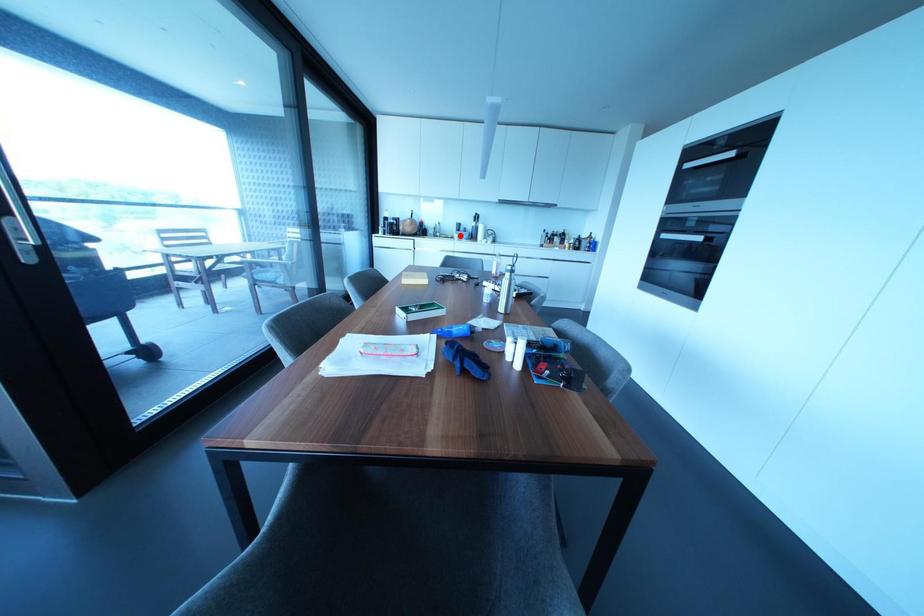
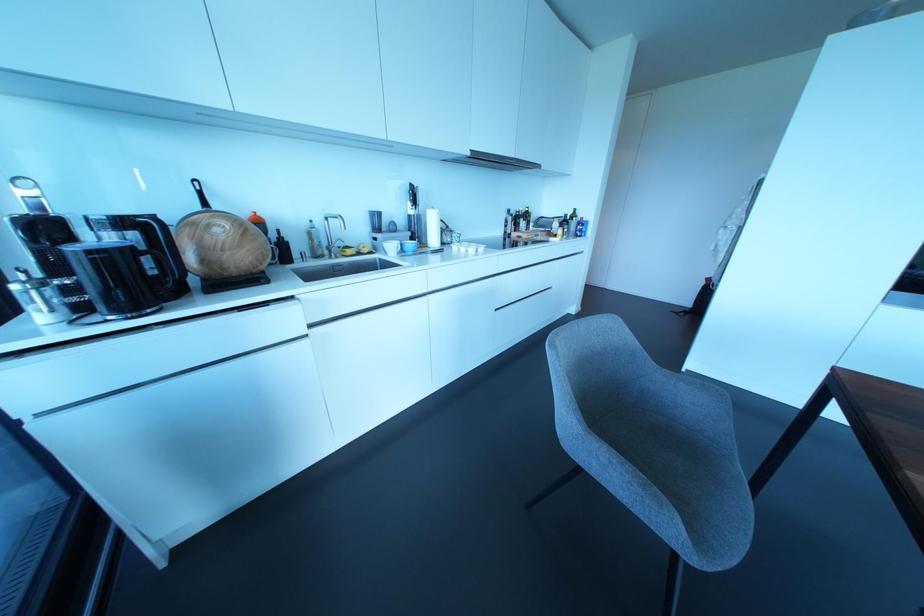
Locate, in the second image, the point that corresponds to the highlighted location in the first image.

(400, 244)